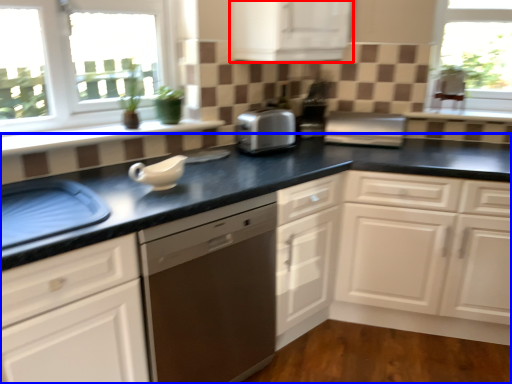
Question: Which point is closer to the camera, cabinetry (highlighted by a red box) or countertop (highlighted by a blue box)?

Choices:
 (A) cabinetry
 (B) countertop

Answer: (B)